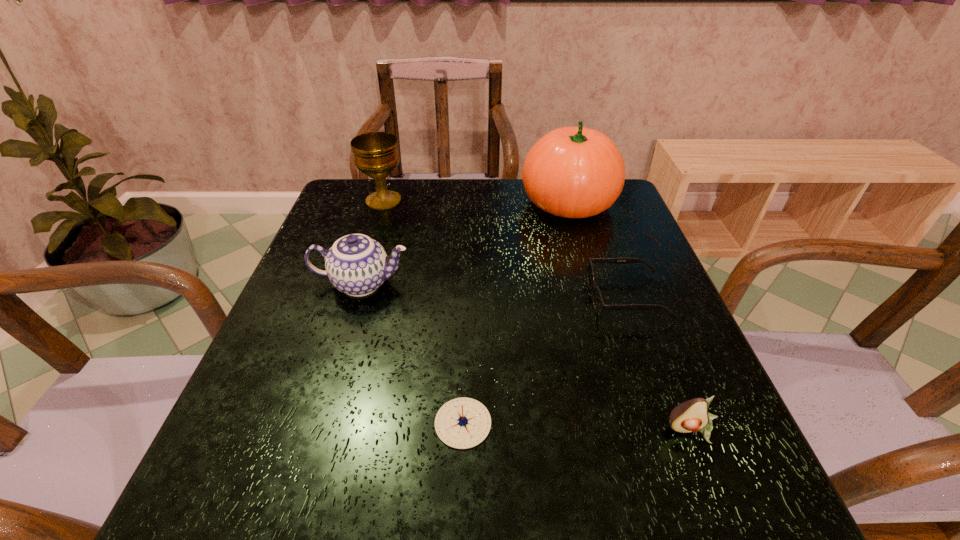
Locate an element on the screen. free spot between the fifth shortest object and the sunglasses is located at coordinates (505, 249).

At what (x,y) coordinates should I click in order to perform the action: click on empty space that is in between the chinaware and the avocado. Please return your answer as a coordinate pair (x, y). The image size is (960, 540). Looking at the image, I should click on (527, 357).

The height and width of the screenshot is (540, 960). I want to click on blank region between the compass and the third tallest object, so click(413, 353).

Image resolution: width=960 pixels, height=540 pixels. Identify the location of vacant area between the third object from left to right and the sunglasses. (545, 360).

The height and width of the screenshot is (540, 960). What are the coordinates of `vacant space in between the avocado and the third tallest object` in the screenshot? It's located at (527, 357).

Find the location of a particular element. The height and width of the screenshot is (540, 960). free space between the compass and the chinaware is located at coordinates (413, 353).

Locate an element on the screen. empty space between the compass and the second tallest object is located at coordinates (423, 312).

In order to click on object that is the fourth closest to the sunglasses in this screenshot , I will do `click(357, 265)`.

Locate which object ranks fourth in proximity to the chalice. Please provide its 2D coordinates. Your answer should be formatted as a tuple, i.e. [(x, y)], where the tuple contains the x and y coordinates of a point satisfying the conditions above.

[(462, 423)]

At what (x,y) coordinates should I click in order to perform the action: click on vacant space that satisfies the following two spatial constraints: 1. on the back side of the third object from left to right; 2. at the spout of the chinaware. Please return your answer as a coordinate pair (x, y). This screenshot has height=540, width=960. Looking at the image, I should click on (468, 284).